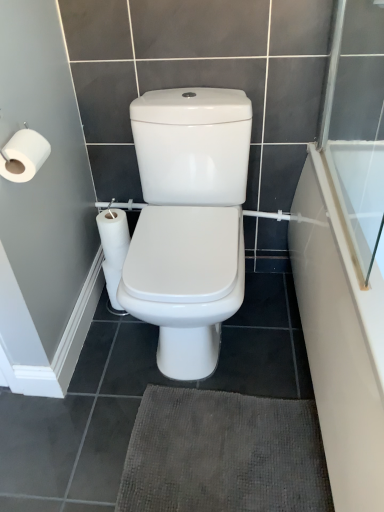
Question: From the image's perspective, is white glossy bathtub at right over white matte toilet paper at left?

Choices:
 (A) yes
 (B) no

Answer: (B)

Question: Is white glossy bathtub at right outside of white matte toilet paper at left?

Choices:
 (A) yes
 (B) no

Answer: (A)

Question: Considering the relative positions of white glossy bathtub at right and white matte toilet paper at left in the image provided, is white glossy bathtub at right to the right of white matte toilet paper at left from the viewer's perspective?

Choices:
 (A) no
 (B) yes

Answer: (B)

Question: Is white glossy bathtub at right turned away from white matte toilet paper at left?

Choices:
 (A) no
 (B) yes

Answer: (A)

Question: Does white glossy bathtub at right have a lesser width compared to white matte toilet paper at left?

Choices:
 (A) yes
 (B) no

Answer: (B)

Question: Is dark gray textured bath mat at lower center bigger or smaller than white matte toilet paper at left?

Choices:
 (A) small
 (B) big

Answer: (B)

Question: In terms of width, does dark gray textured bath mat at lower center look wider or thinner when compared to white matte toilet paper at left?

Choices:
 (A) thin
 (B) wide

Answer: (B)

Question: From the image's perspective, is dark gray textured bath mat at lower center positioned above or below white matte toilet paper at left?

Choices:
 (A) below
 (B) above

Answer: (A)

Question: Is point (263, 506) closer or farther from the camera than point (36, 150)?

Choices:
 (A) closer
 (B) farther

Answer: (B)

Question: Is white matte toilet paper at left to the left or to the right of transparent glass screen door at upper right in the image?

Choices:
 (A) left
 (B) right

Answer: (A)

Question: From a real-world perspective, is white matte toilet paper at left physically located above or below transparent glass screen door at upper right?

Choices:
 (A) below
 (B) above

Answer: (A)

Question: Is point (9, 143) closer or farther from the camera than point (354, 76)?

Choices:
 (A) closer
 (B) farther

Answer: (A)

Question: Looking at the image, does white matte toilet paper at left seem bigger or smaller compared to transparent glass screen door at upper right?

Choices:
 (A) big
 (B) small

Answer: (B)

Question: Based on their positions, is transparent glass screen door at upper right located to the left or right of dark gray textured bath mat at lower center?

Choices:
 (A) right
 (B) left

Answer: (A)

Question: In terms of width, does transparent glass screen door at upper right look wider or thinner when compared to dark gray textured bath mat at lower center?

Choices:
 (A) wide
 (B) thin

Answer: (B)